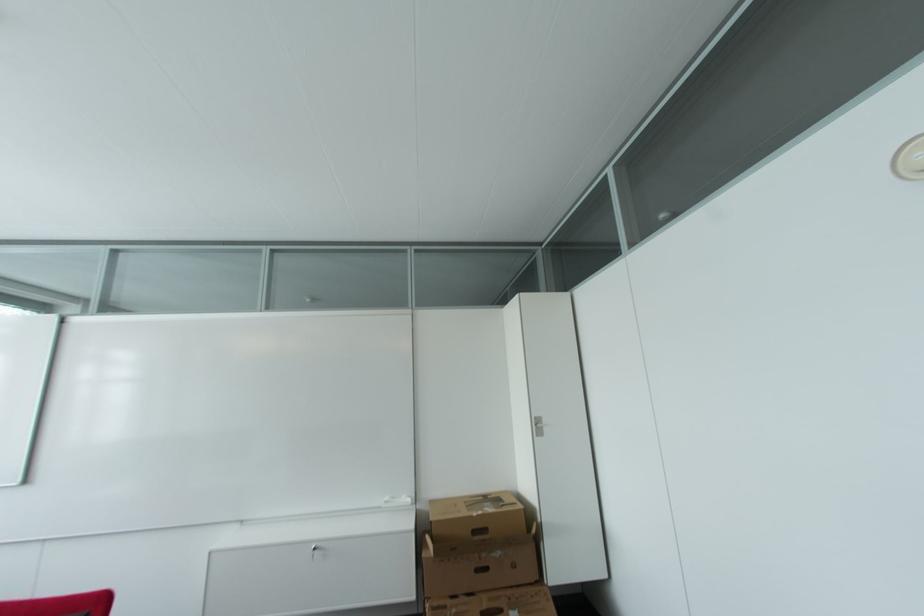
You are a GUI agent. You are given a task and a screenshot of the screen. Output one action in this format:
    pyautogui.click(x=<x>, y=<y>)
    Task: Click on the white cabinet lock
    
    Given the screenshot: What is the action you would take?
    pyautogui.click(x=538, y=426)